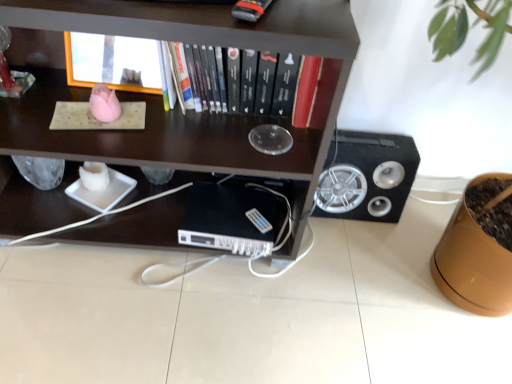
I want to click on vacant region in front of dark wood shelf at upper center, arranged as the 1th shelf when ordered from the bottom, so click(x=126, y=318).